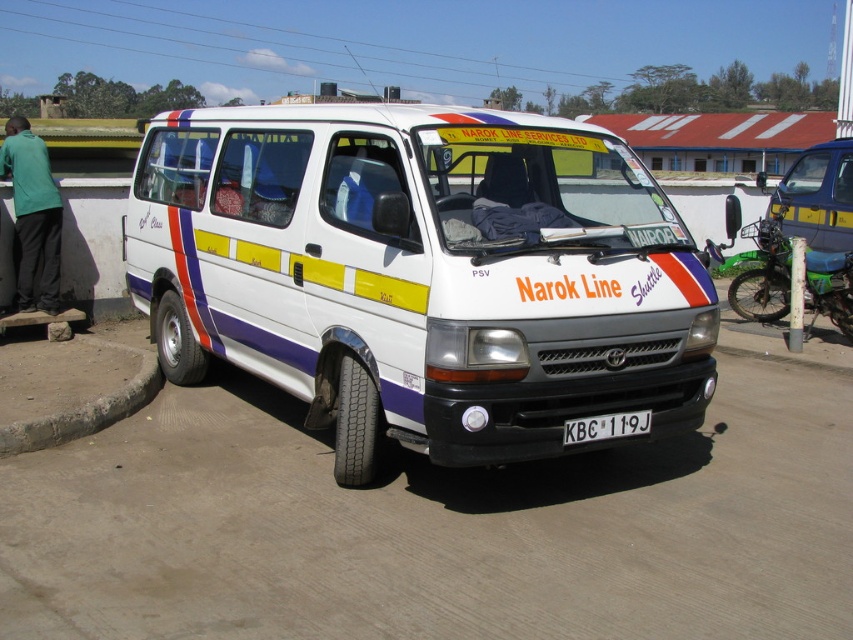
Who is shorter, green plastic motorcycle at right or green fabric shirt at left?

A: green fabric shirt at left is shorter.

Is point (730, 288) closer to camera compared to point (41, 182)?

No, it is not.

What do you see at coordinates (762, 273) in the screenshot?
I see `green plastic motorcycle at right` at bounding box center [762, 273].

I want to click on green plastic motorcycle at right, so click(x=762, y=273).

Who is shorter, white glossy van at center or green fabric shirt at left?

Standing shorter between the two is green fabric shirt at left.

Describe the element at coordinates (421, 273) in the screenshot. This screenshot has height=640, width=853. I see `white glossy van at center` at that location.

Is point (286, 264) positioned after point (45, 300)?

That is False.

Where is `white glossy van at center`? white glossy van at center is located at coordinates (421, 273).

Which is in front, point (265, 266) or point (729, 301)?

Point (265, 266) is in front.

Describe the element at coordinates (421, 273) in the screenshot. This screenshot has width=853, height=640. I see `white glossy van at center` at that location.

The height and width of the screenshot is (640, 853). In order to click on white glossy van at center in this screenshot , I will do `click(421, 273)`.